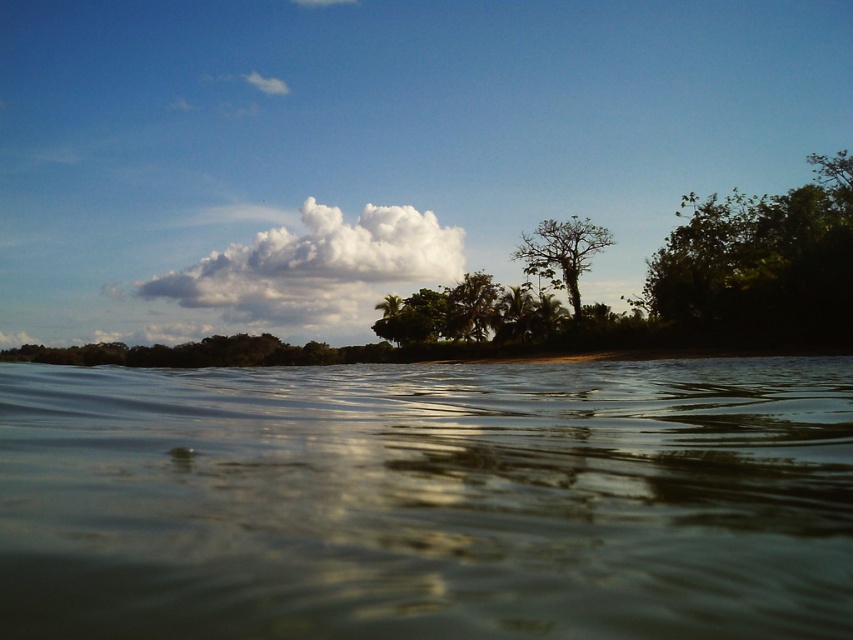
From the picture: You are standing at the edge of the water in the scene. You notice a point marked at coordinates [428,499]. What is the location of this point relative to the brown murky water at center?

The point at coordinates [428,499] corresponds to the brown murky water at center, so it is located exactly at the center of the water area.

You are standing at the edge of the water and want to reach the two points marked in the image. Which point, point (402,269) or point (567,269), is closer to you?

Point (402,269) is closer to you because it is further to the viewer than point (567,269).